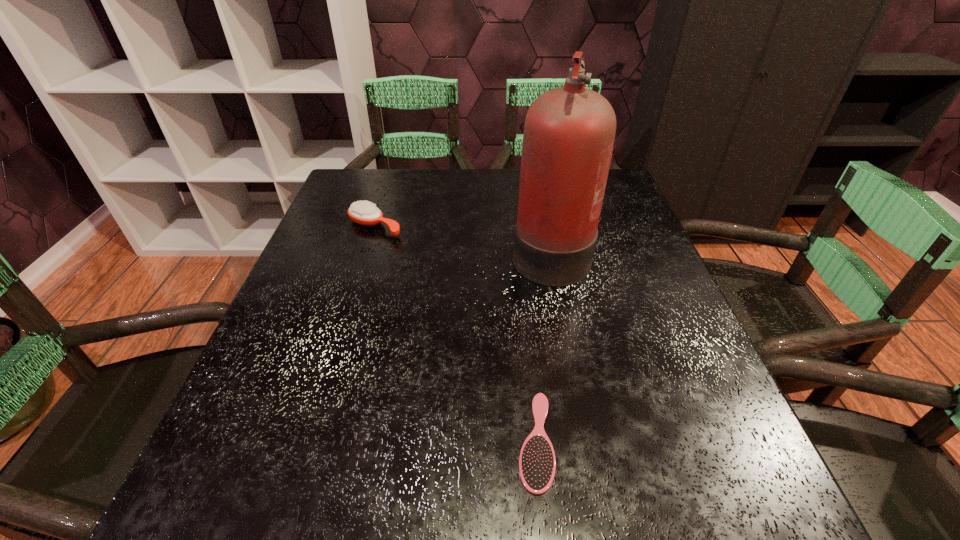
Locate an element on the screen. The image size is (960, 540). fire extinguisher is located at coordinates (569, 132).

Where is `the taller hairbrush`? the taller hairbrush is located at coordinates (364, 213).

The image size is (960, 540). Find the location of `the left hairbrush`. the left hairbrush is located at coordinates (364, 213).

This screenshot has height=540, width=960. Find the location of `the nearest object`. the nearest object is located at coordinates (537, 464).

The image size is (960, 540). Identify the location of the shortest object. (537, 464).

Image resolution: width=960 pixels, height=540 pixels. Identify the location of vacant area located at the nozzle of the tallest object. (338, 251).

This screenshot has width=960, height=540. I want to click on vacant space located at the nozzle of the tallest object, so click(x=355, y=251).

Where is `free space located at the nozzle of the tallest object`? free space located at the nozzle of the tallest object is located at coordinates (473, 251).

Identify the location of vacant space located 0.340m on the front of the farther hairbrush. This screenshot has width=960, height=540. (335, 355).

At what (x,y) coordinates should I click in order to perform the action: click on vacant area situated on the right of the right hairbrush. Please return your answer as a coordinate pair (x, y). Looking at the image, I should click on (719, 441).